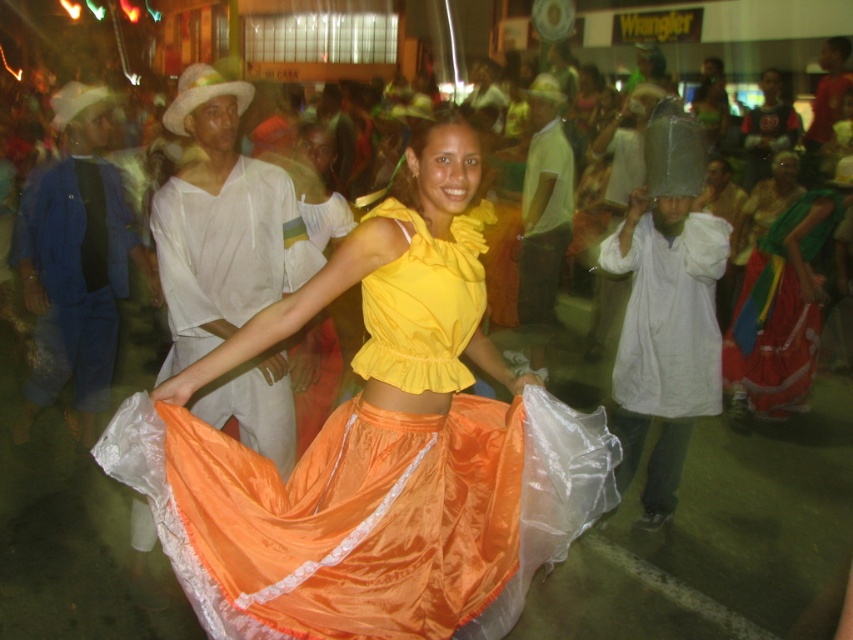
Which is behind, point (461, 612) or point (811, 360)?

The point (811, 360) is more distant.

Consider the image. Who is more forward, (x=405, y=449) or (x=791, y=248)?

Point (x=405, y=449) is in front.

In order to click on shiny satin skirt at center in this screenshot , I will do `click(375, 451)`.